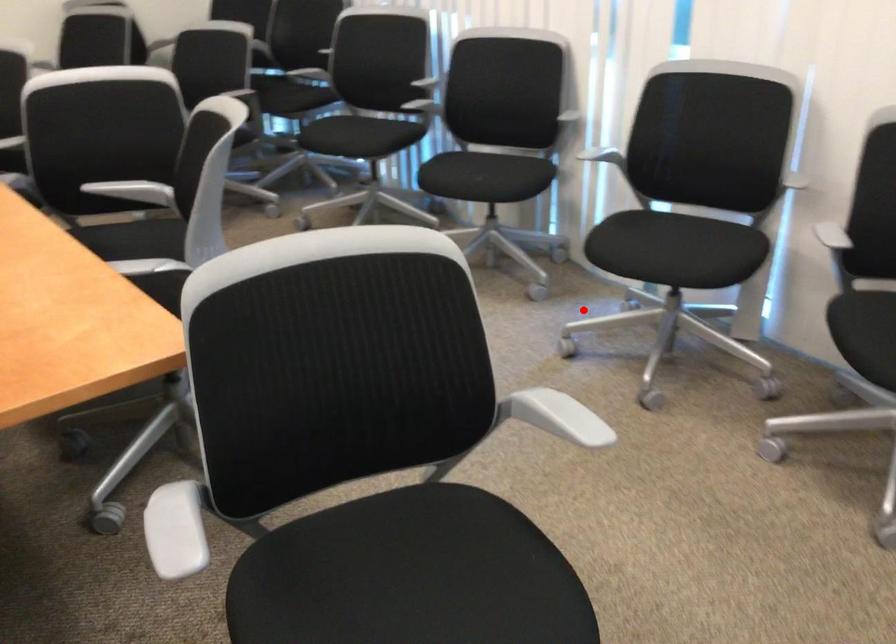
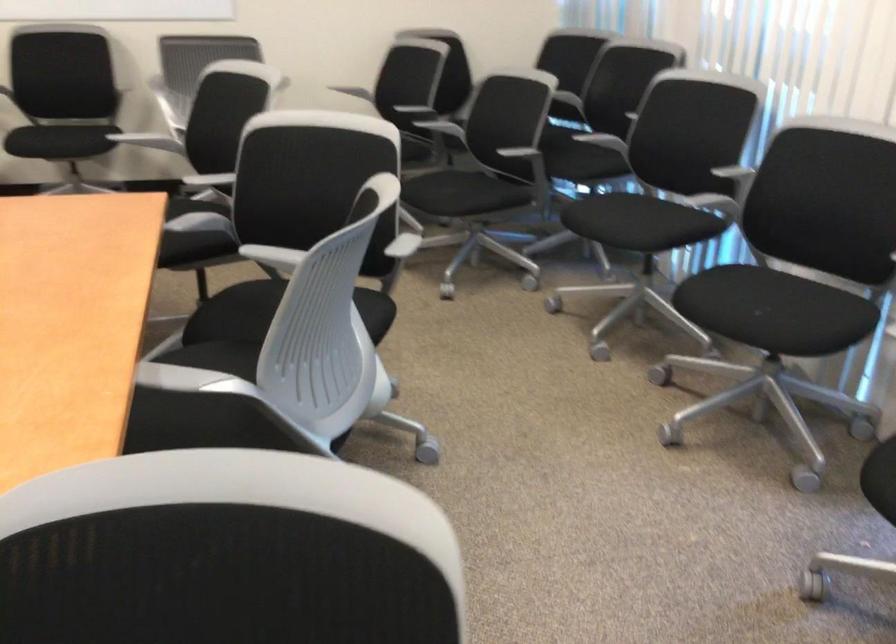
Question: A red point is marked in image1. In image2, is the corresponding 3D point closer to the camera or farther? Reply with the corresponding letter.

Choices:
 (A) The corresponding 3D point is closer.
 (B) The corresponding 3D point is farther.

Answer: (A)